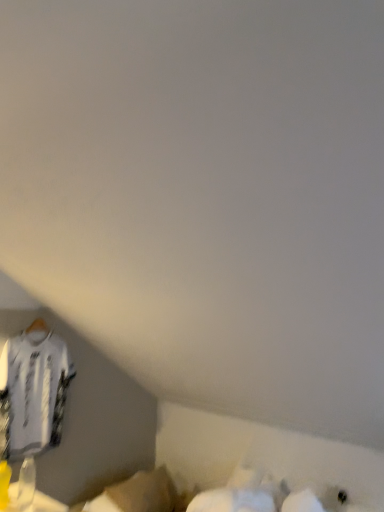
Question: From the image's perspective, is white fabric at lower center located above or below white jersey at left?

Choices:
 (A) below
 (B) above

Answer: (A)

Question: Looking at their shapes, would you say white fabric at lower center is wider or thinner than white jersey at left?

Choices:
 (A) wide
 (B) thin

Answer: (A)

Question: In terms of size, does white fabric at lower center appear bigger or smaller than white jersey at left?

Choices:
 (A) big
 (B) small

Answer: (B)

Question: Considering their positions, is white jersey at left located in front of or behind white fabric at lower center?

Choices:
 (A) front
 (B) behind

Answer: (A)

Question: In terms of size, does white jersey at left appear bigger or smaller than white fabric at lower center?

Choices:
 (A) small
 (B) big

Answer: (B)

Question: Considering the positions of point (14, 347) and point (162, 481), is point (14, 347) closer or farther from the camera than point (162, 481)?

Choices:
 (A) farther
 (B) closer

Answer: (B)

Question: From a real-world perspective, is white jersey at left physically located above or below white fabric at lower center?

Choices:
 (A) above
 (B) below

Answer: (A)